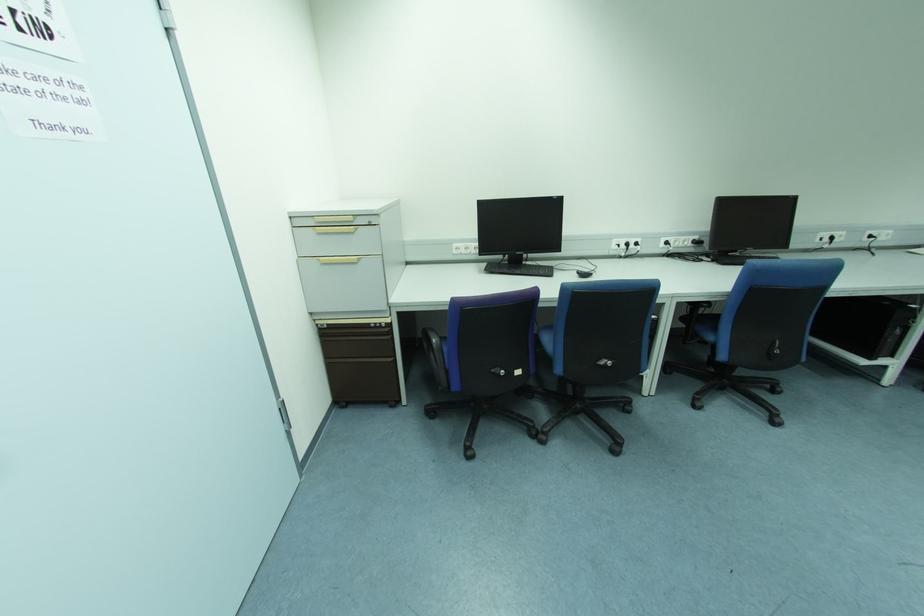
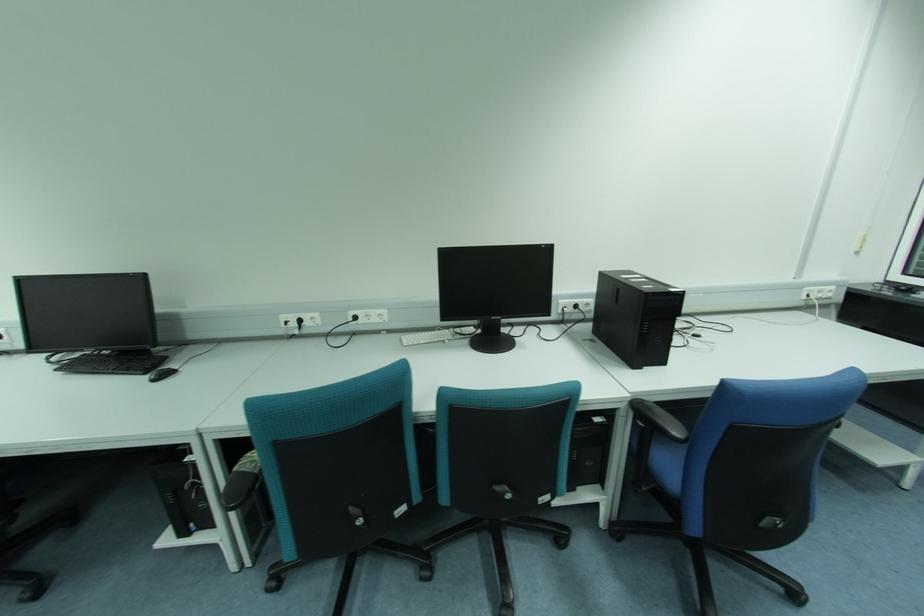
Question: In a continuous first-person perspective shot, in which direction is the camera moving?

Choices:
 (A) Left
 (B) Right
 (C) Forward
 (D) Backward

Answer: (B)